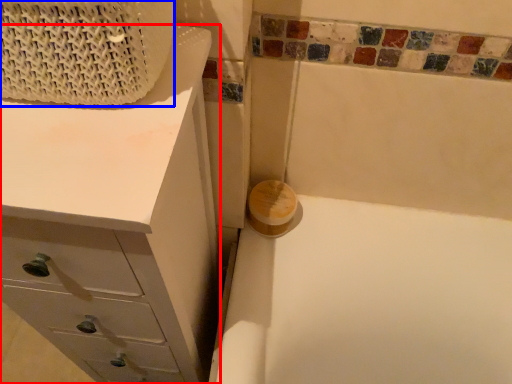
Question: Which of the following is the closest to the observer, chest of drawers (highlighted by a red box) or basket (highlighted by a blue box)?

Choices:
 (A) chest of drawers
 (B) basket

Answer: (B)